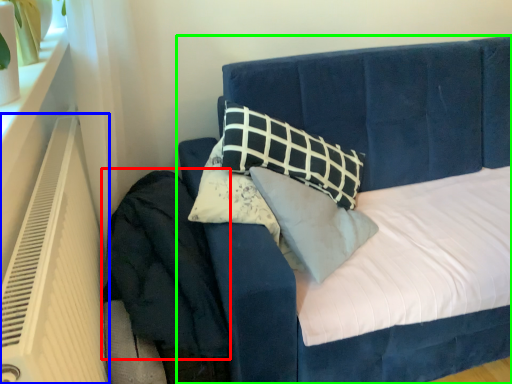
Question: Which is nearer to the velvet (highlighted by a red box)? heater (highlighted by a blue box) or bed (highlighted by a green box).

Choices:
 (A) heater
 (B) bed

Answer: (A)